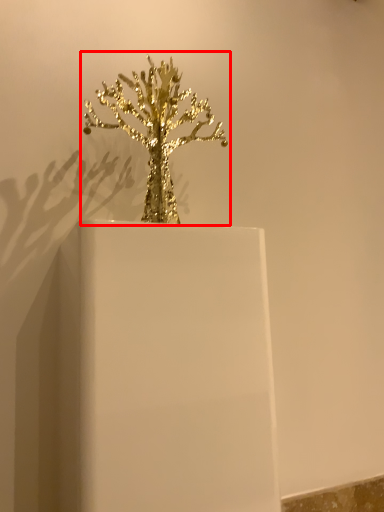
Question: From the image's perspective, where is houseplant (annotated by the red box) located in relation to candle holder in the image?

Choices:
 (A) below
 (B) above

Answer: (B)